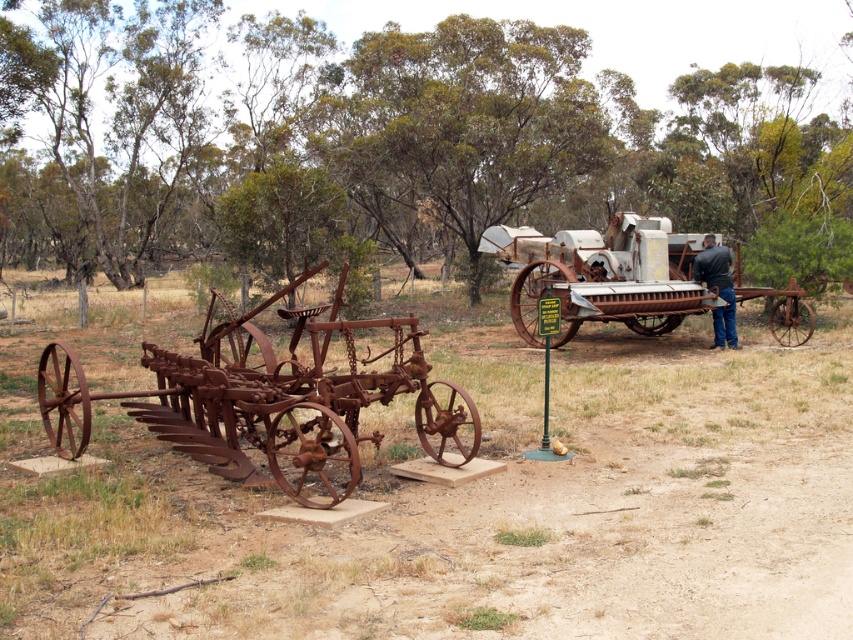
Does rusty metal plow at left have a smaller size compared to rusty metal tractor at center?

Incorrect, rusty metal plow at left is not smaller in size than rusty metal tractor at center.

Is point (154, 636) positioned after point (631, 225)?

No.

Find the location of a particular element. The image size is (853, 640). rusty metal plow at left is located at coordinates (474, 506).

The width and height of the screenshot is (853, 640). Find the location of `rusty metal plow at left`. rusty metal plow at left is located at coordinates (474, 506).

Which of these two, rusty metal plow at left or rusty metal tractor at left, stands shorter?

rusty metal tractor at left

Who is higher up, rusty metal plow at left or rusty metal tractor at left?

rusty metal plow at left is above.

Where is `rusty metal plow at left`? This screenshot has height=640, width=853. rusty metal plow at left is located at coordinates (474, 506).

Does rusty metal plow at left appear on the right side of dark blue jeans at center?

No, rusty metal plow at left is not to the right of dark blue jeans at center.

Between rusty metal plow at left and dark blue jeans at center, which one has more height?

rusty metal plow at left

The width and height of the screenshot is (853, 640). Identify the location of rusty metal plow at left. (474, 506).

You are a GUI agent. You are given a task and a screenshot of the screen. Output one action in this format:
    pyautogui.click(x=<x>, y=<y>)
    Task: Click on the rusty metal plow at left
    
    Given the screenshot: What is the action you would take?
    pyautogui.click(x=474, y=506)